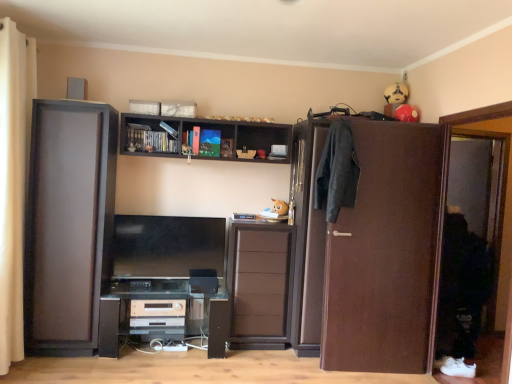
Question: Are dark wood shelf at upper center and black plastic computer desk at lower center beside each other?

Choices:
 (A) yes
 (B) no

Answer: (B)

Question: From a real-world perspective, is dark wood shelf at upper center on top of black plastic computer desk at lower center?

Choices:
 (A) yes
 (B) no

Answer: (A)

Question: From the image's perspective, is dark wood shelf at upper center beneath black plastic computer desk at lower center?

Choices:
 (A) yes
 (B) no

Answer: (B)

Question: Considering the relative positions of dark wood shelf at upper center and black plastic computer desk at lower center in the image provided, is dark wood shelf at upper center behind black plastic computer desk at lower center?

Choices:
 (A) no
 (B) yes

Answer: (B)

Question: Can you confirm if dark wood shelf at upper center is taller than black plastic computer desk at lower center?

Choices:
 (A) no
 (B) yes

Answer: (A)

Question: In the image, is dark wood shelf at upper center positioned in front of or behind brown wooden screen door at right?

Choices:
 (A) behind
 (B) front

Answer: (A)

Question: Considering the positions of dark wood shelf at upper center and brown wooden screen door at right in the image, is dark wood shelf at upper center bigger or smaller than brown wooden screen door at right?

Choices:
 (A) small
 (B) big

Answer: (A)

Question: Considering the positions of dark wood shelf at upper center and brown wooden screen door at right in the image, is dark wood shelf at upper center wider or thinner than brown wooden screen door at right?

Choices:
 (A) wide
 (B) thin

Answer: (A)

Question: From their relative heights in the image, would you say dark wood shelf at upper center is taller or shorter than brown wooden screen door at right?

Choices:
 (A) short
 (B) tall

Answer: (A)

Question: From the image's perspective, relative to brown wooden screen door at right, is beige fabric curtain at left above or below?

Choices:
 (A) above
 (B) below

Answer: (A)

Question: Does point (2, 370) appear closer or farther from the camera than point (498, 190)?

Choices:
 (A) farther
 (B) closer

Answer: (B)

Question: Would you say beige fabric curtain at left is inside or outside brown wooden screen door at right?

Choices:
 (A) inside
 (B) outside

Answer: (B)

Question: Is beige fabric curtain at left bigger or smaller than brown wooden screen door at right?

Choices:
 (A) big
 (B) small

Answer: (A)

Question: Is matte black cupboard at left to the left or to the right of dark gray fabric coat at right in the image?

Choices:
 (A) right
 (B) left

Answer: (B)

Question: Considering the positions of matte black cupboard at left and dark gray fabric coat at right in the image, is matte black cupboard at left bigger or smaller than dark gray fabric coat at right?

Choices:
 (A) big
 (B) small

Answer: (A)